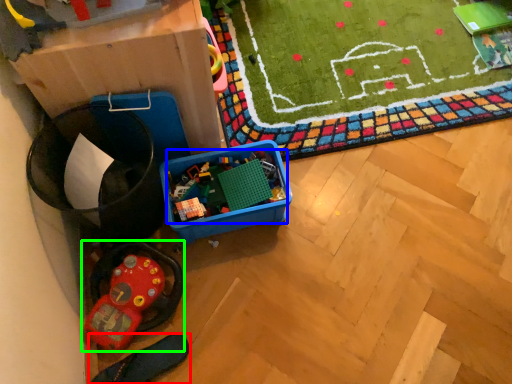
Question: Considering the real-world distances, which object is farthest from footwear (highlighted by a red box)? toy (highlighted by a blue box) or toy (highlighted by a green box)?

Choices:
 (A) toy
 (B) toy

Answer: (A)